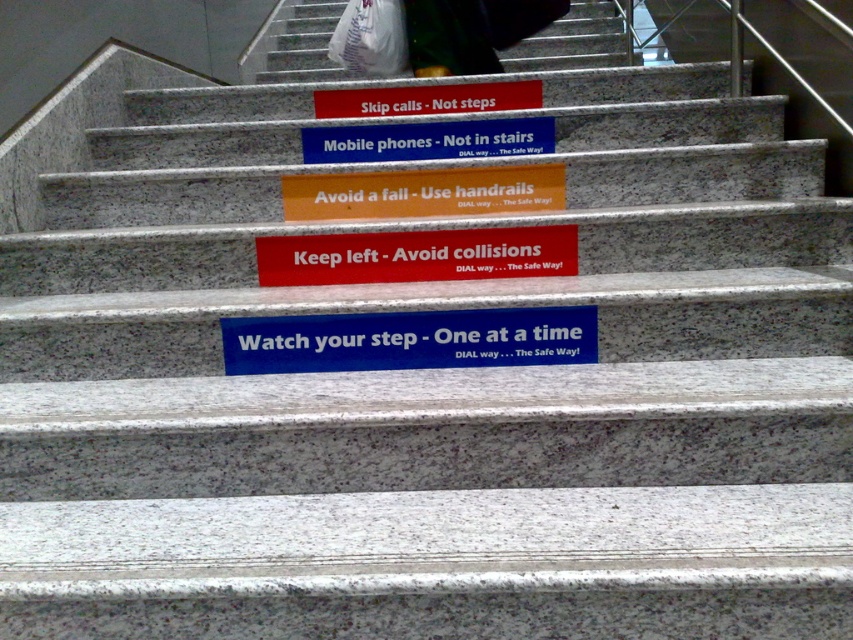
Which is more to the right, blue matte sign at center or blue plastic sign at center?

blue plastic sign at center is more to the right.

Can you confirm if blue matte sign at center is positioned to the right of blue plastic sign at center?

No, blue matte sign at center is not to the right of blue plastic sign at center.

Is point (265, 356) positioned after point (479, 122)?

That is False.

Where is `blue matte sign at center`? This screenshot has width=853, height=640. blue matte sign at center is located at coordinates [409, 339].

Is orange matte sign at center smaller than matte plastic sign at upper center?

Indeed, orange matte sign at center has a smaller size compared to matte plastic sign at upper center.

Between point (428, 202) and point (339, 100), which one is positioned behind?

The point (339, 100) is behind.

Find the location of a particular element. The height and width of the screenshot is (640, 853). orange matte sign at center is located at coordinates point(422,193).

The width and height of the screenshot is (853, 640). What are the coordinates of `orange matte sign at center` in the screenshot? It's located at (422, 193).

Locate an element on the screen. The height and width of the screenshot is (640, 853). red matte sign at center is located at coordinates (416, 256).

The width and height of the screenshot is (853, 640). What are the coordinates of `red matte sign at center` in the screenshot? It's located at (416, 256).